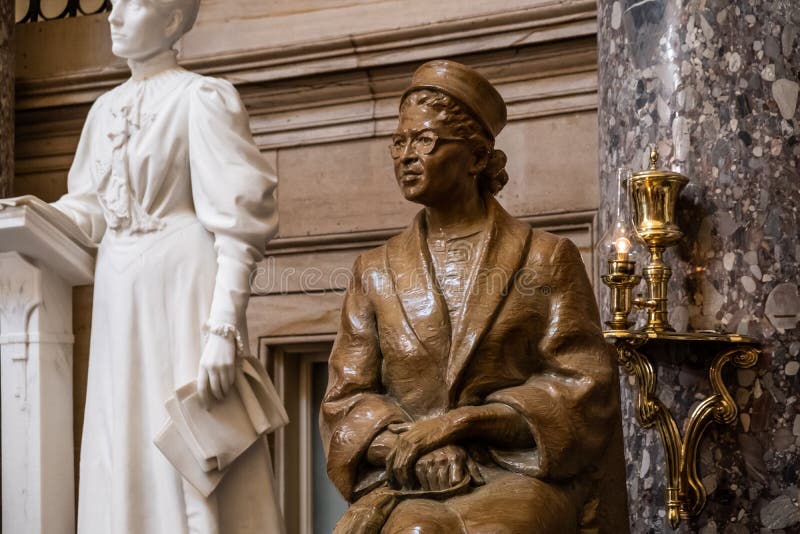
Identify the location of statue. (162, 182), (220, 483).